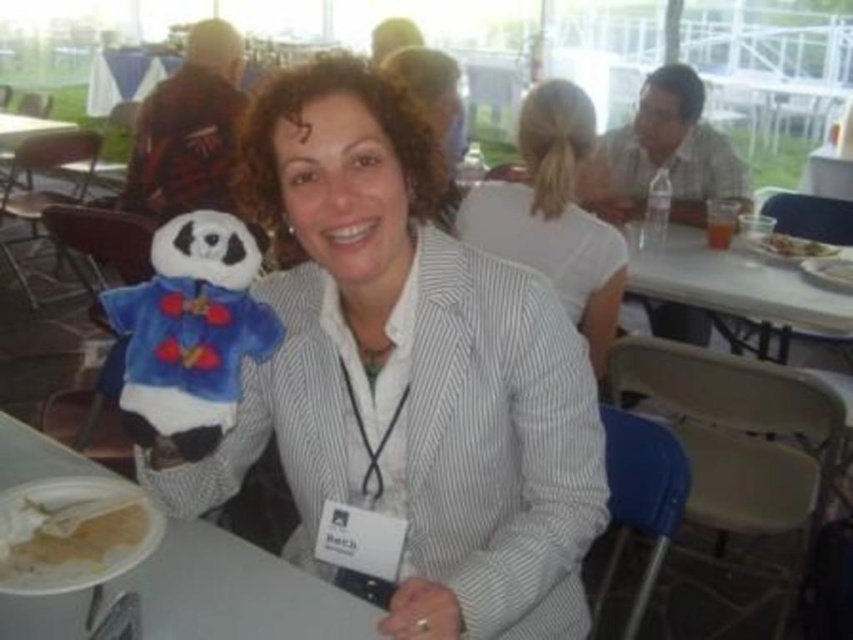
Between white matte shirt at upper center and smooth plastic fork at upper right, which one appears on the left side from the viewer's perspective?

From the viewer's perspective, white matte shirt at upper center appears more on the left side.

Who is taller, white matte shirt at upper center or smooth plastic fork at upper right?

With more height is white matte shirt at upper center.

Locate an element on the screen. The image size is (853, 640). white matte shirt at upper center is located at coordinates (554, 214).

Does white plastic table at upper right appear on the left side of smooth plastic fork at upper right?

Yes, white plastic table at upper right is to the left of smooth plastic fork at upper right.

Looking at this image, is the position of white plastic table at upper right less distant than that of smooth plastic fork at upper right?

That is True.

Identify the location of white plastic table at upper right. The image size is (853, 640). (746, 298).

Locate an element on the screen. The height and width of the screenshot is (640, 853). white plastic table at upper right is located at coordinates (746, 298).

Is velvet plush panda at left in front of white paper plate at lower left?

Yes.

Who is positioned more to the left, velvet plush panda at left or white paper plate at lower left?

From the viewer's perspective, white paper plate at lower left appears more on the left side.

Where is `velvet plush panda at left`? The height and width of the screenshot is (640, 853). velvet plush panda at left is located at coordinates (190, 330).

Locate an element on the screen. This screenshot has width=853, height=640. velvet plush panda at left is located at coordinates (190, 330).